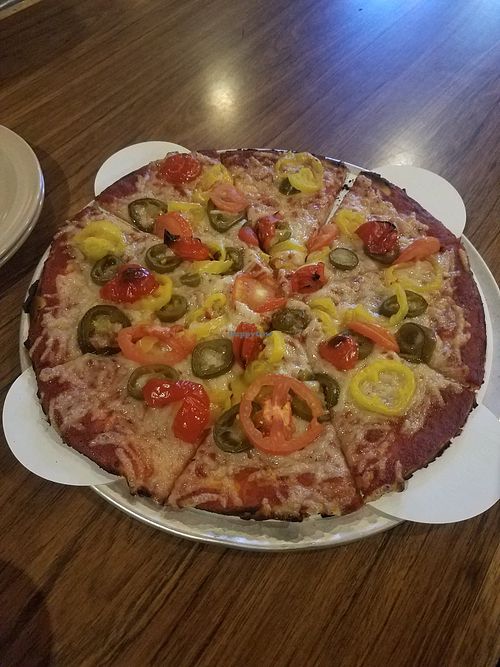
This screenshot has width=500, height=667. I want to click on plate, so click(x=25, y=189), click(x=16, y=247).